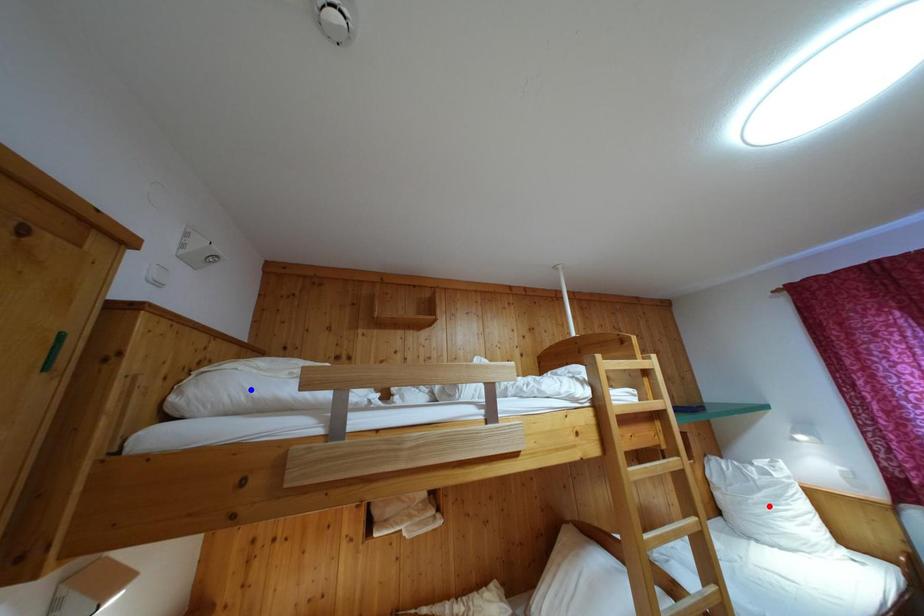
Question: Which of the two points in the image is closer to the camera?

Choices:
 (A) Blue point is closer.
 (B) Red point is closer.

Answer: (A)